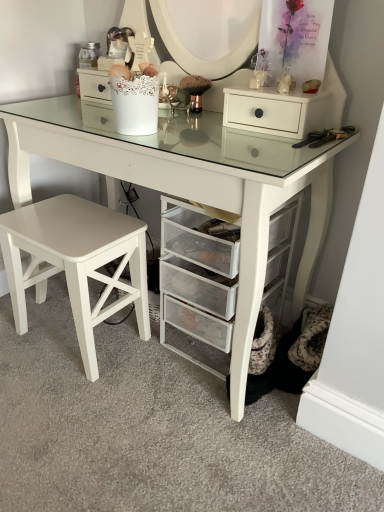
Question: Is clear mesh drawers at center bigger or smaller than white matte drawer at upper right?

Choices:
 (A) big
 (B) small

Answer: (A)

Question: From a real-world perspective, is clear mesh drawers at center above or below white matte drawer at upper right?

Choices:
 (A) above
 (B) below

Answer: (B)

Question: Which object is positioned farthest from the white glossy table at center?

Choices:
 (A) white matte stool at lower left
 (B) white matte drawer at upper right
 (C) clear mesh drawers at center

Answer: (A)

Question: Based on their relative distances, which object is farther from the white glossy table at center?

Choices:
 (A) clear mesh drawers at center
 (B) white matte drawer at upper right
 (C) white matte stool at lower left

Answer: (C)